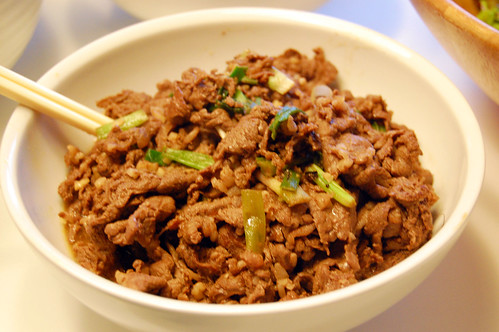
Locate an element on the screen. wooden bowl is located at coordinates (481, 57).